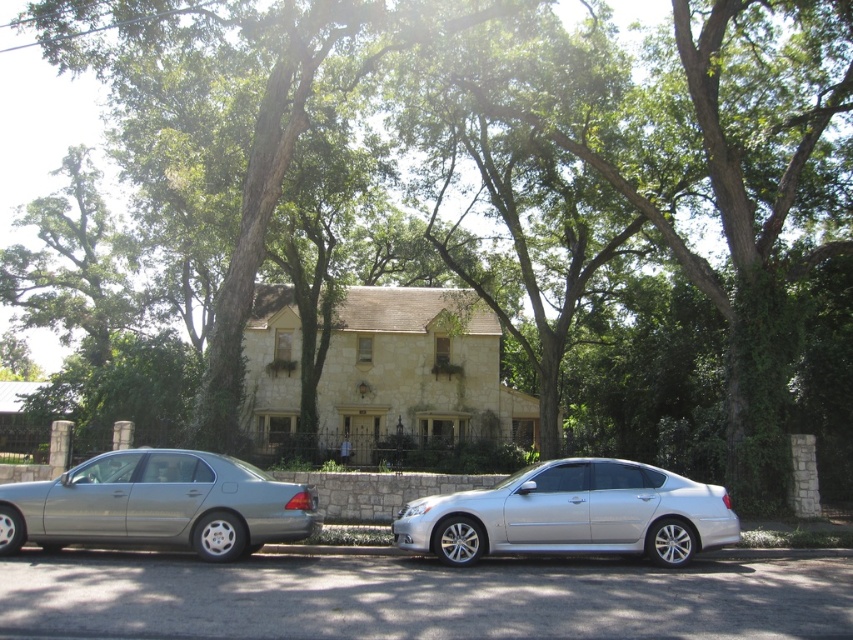
Based on the photo, who is more distant from viewer, (538, 552) or (283, 516)?

Point (283, 516)

Is silver metallic sedan at center bigger than satin silver sedan at left?

Correct, silver metallic sedan at center is larger in size than satin silver sedan at left.

The width and height of the screenshot is (853, 640). Describe the element at coordinates (572, 515) in the screenshot. I see `silver metallic sedan at center` at that location.

Where is `silver metallic sedan at center`? This screenshot has width=853, height=640. silver metallic sedan at center is located at coordinates (572, 515).